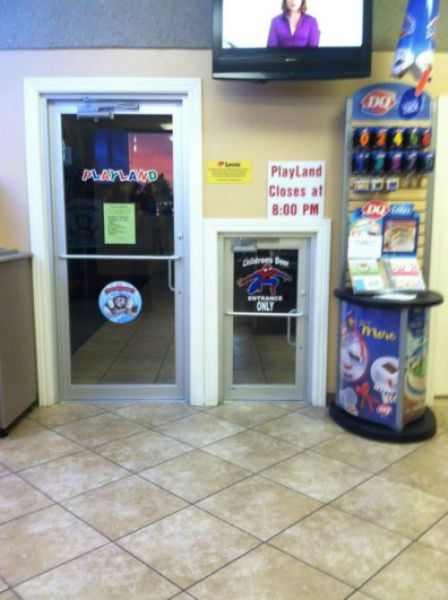
Locate an element on the screen. Image resolution: width=448 pixels, height=600 pixels. top counter is located at coordinates (3, 247).